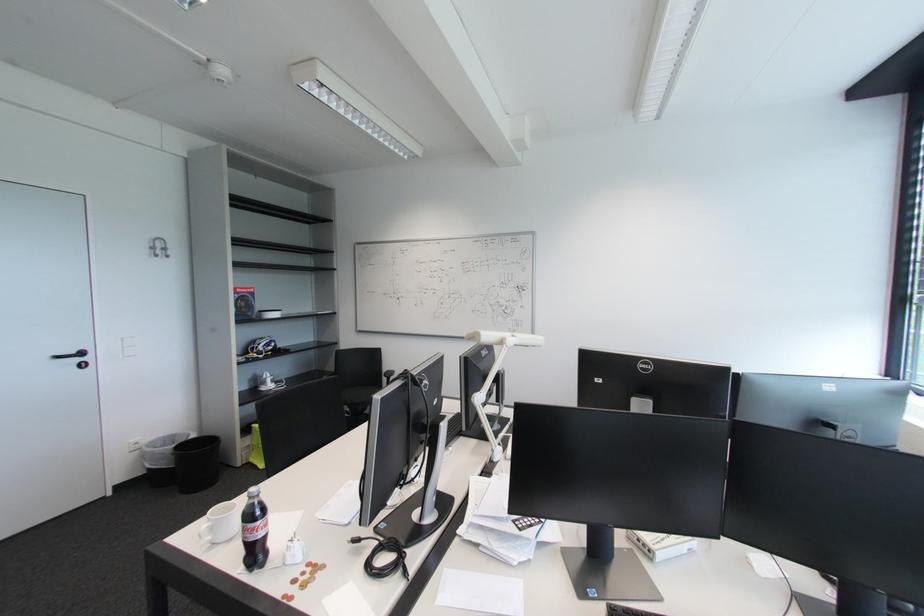
What do you see at coordinates (387, 377) in the screenshot? Image resolution: width=924 pixels, height=616 pixels. I see `the chair armrest` at bounding box center [387, 377].